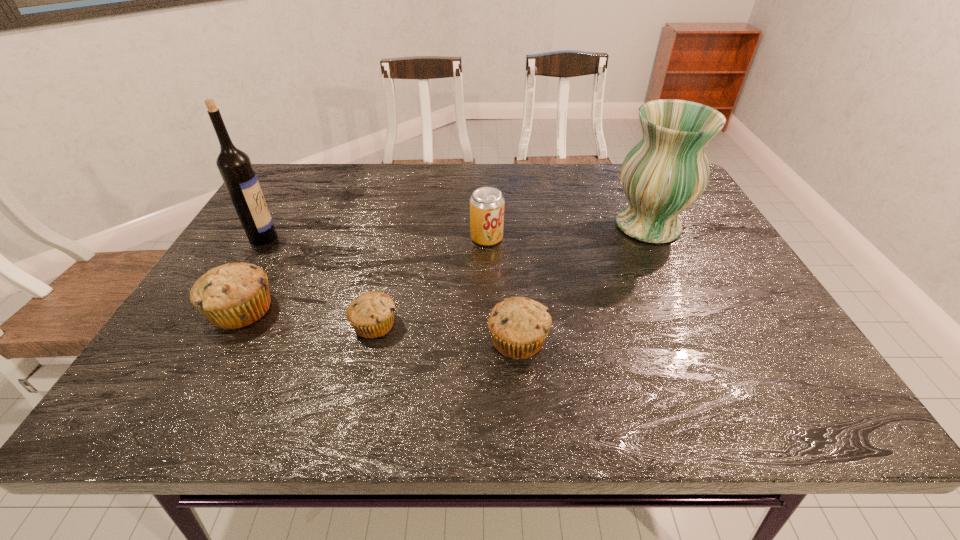
At what (x,y) coordinates should I click in order to perform the action: click on free spot located 0.330m on the left of the fourth object from right to left. Please return your answer as a coordinate pair (x, y). Looking at the image, I should click on (197, 325).

Identify the location of vacant space located 0.060m on the back of the rightmost muffin. (515, 299).

Where is `vacant space located on the front of the rightmost object`? The height and width of the screenshot is (540, 960). vacant space located on the front of the rightmost object is located at coordinates (705, 343).

This screenshot has height=540, width=960. What are the coordinates of `vacant space situated on the label of the wine bottle` in the screenshot? It's located at (409, 238).

The height and width of the screenshot is (540, 960). Identify the location of vacant space located on the right of the pop (soda). (609, 238).

The width and height of the screenshot is (960, 540). What are the coordinates of `muffin situated at the left edge` in the screenshot? It's located at (234, 295).

This screenshot has width=960, height=540. I want to click on wine bottle located at the left edge, so click(234, 165).

This screenshot has height=540, width=960. I want to click on object that is positioned at the right edge, so click(x=667, y=171).

Identify the location of object situated at the near left corner. (234, 295).

Locate an element on the screen. vacant position at the far edge of the desktop is located at coordinates (389, 198).